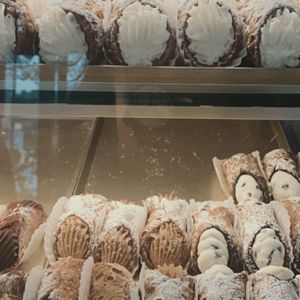
Find the location of a particular element. The image size is (300, 300). bakery shelf is located at coordinates (145, 87), (145, 145), (61, 153).